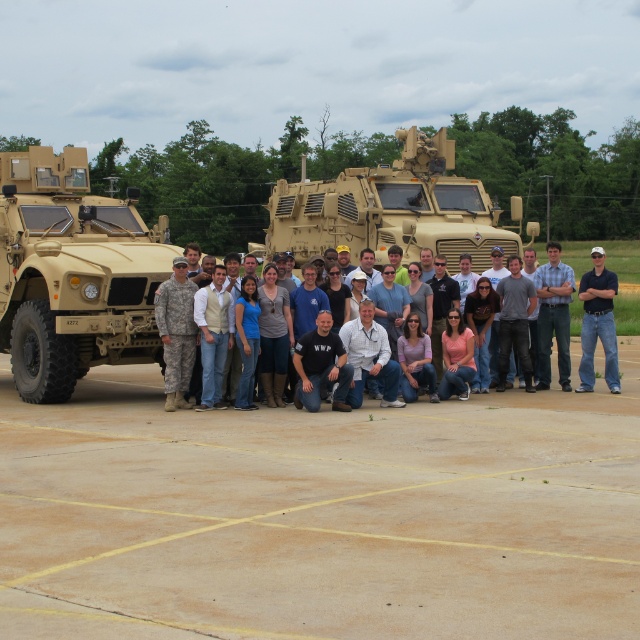
Can you confirm if black cotton shirt at center is positioned below dark blue shirt at center?

Yes.

Identify the location of black cotton shirt at center. (596, 323).

Identify the location of black cotton shirt at center. point(596,323).

Can you confirm if camouflage fabric armored vehicle at left is shorter than black cotton shirt at center?

Incorrect, camouflage fabric armored vehicle at left's height does not fall short of black cotton shirt at center's.

Who is positioned more to the right, camouflage fabric armored vehicle at left or black cotton shirt at center?

Positioned to the right is black cotton shirt at center.

I want to click on camouflage fabric armored vehicle at left, so click(x=72, y=273).

You are a GUI agent. You are given a task and a screenshot of the screen. Output one action in this format:
    pyautogui.click(x=<x>, y=<y>)
    Task: Click on the camouflage fabric armored vehicle at left
    Image resolution: width=640 pixels, height=640 pixels.
    Given the screenshot: What is the action you would take?
    pyautogui.click(x=72, y=273)

Looking at this image, is blue shirt at center positioned at the back of black matte shirt at center?

That is False.

Based on the photo, does blue shirt at center have a lesser width compared to black matte shirt at center?

In fact, blue shirt at center might be wider than black matte shirt at center.

Where is `blue shirt at center`? blue shirt at center is located at coordinates (554, 316).